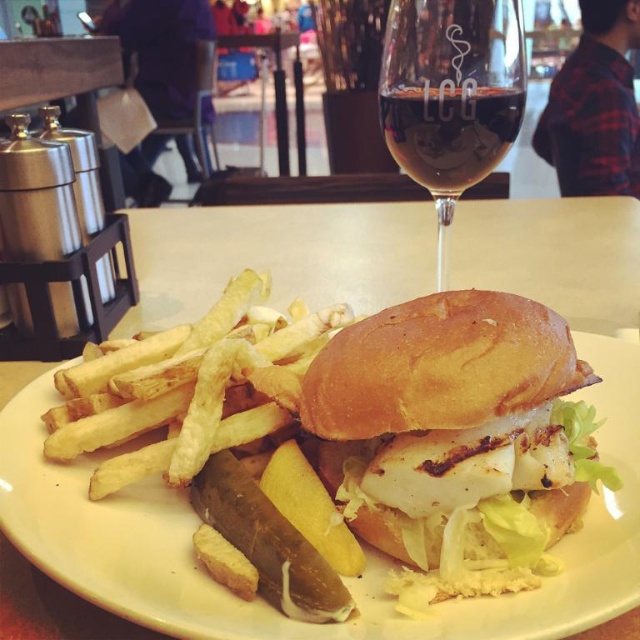
Question: Estimate the real-world distances between objects in this image. Which object is farther from the slightly toasted bun at center?

Choices:
 (A) golden crispy french fries at lower left
 (B) white bread bun at center
 (C) transparent glass wine at upper center

Answer: (C)

Question: Can you confirm if slightly toasted bun at center is positioned below golden crispy french fries at lower left?

Choices:
 (A) no
 (B) yes

Answer: (B)

Question: Observing the image, what is the correct spatial positioning of golden crispy french fries at lower left in reference to transparent glass at upper center?

Choices:
 (A) right
 (B) left

Answer: (B)

Question: Which point is closer to the camera?

Choices:
 (A) transparent glass at upper center
 (B) white bread bun at center
 (C) transparent glass wine at upper center
 (D) slightly toasted bun at center

Answer: (D)

Question: Which point is closer to the camera?

Choices:
 (A) transparent glass wine at upper center
 (B) white bread bun at center

Answer: (B)

Question: Is white bread bun at center to the left of transparent glass at upper center from the viewer's perspective?

Choices:
 (A) yes
 (B) no

Answer: (A)